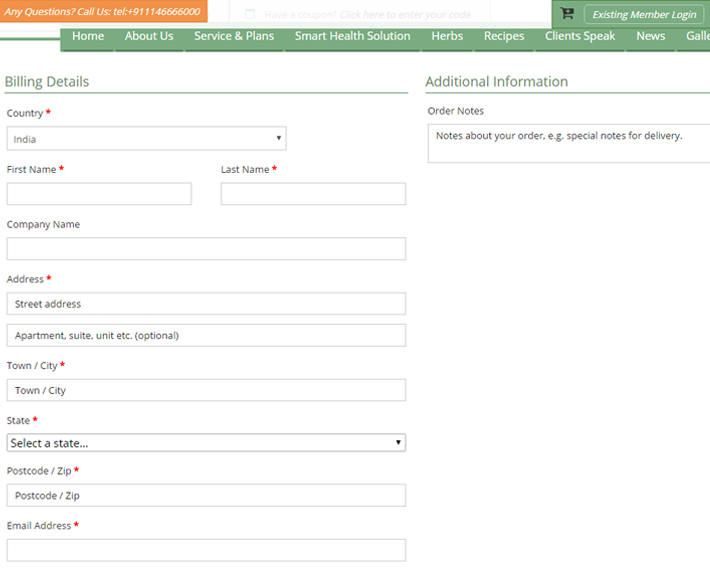
This screenshot has height=575, width=710. What are the coordinates of `billing details text boxes and drop downs` in the screenshot? It's located at (53, 84), (79, 141), (81, 289), (72, 474).